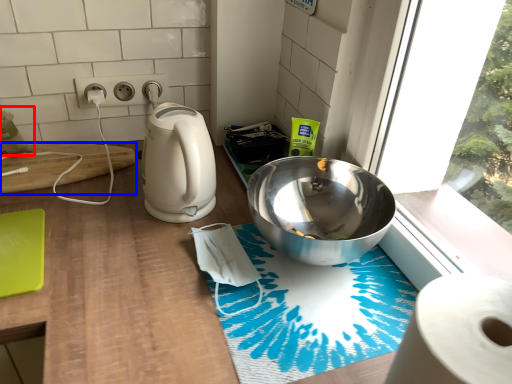
Question: Which of the following is the farthest to the observer, toilet paper (highlighted by a red box) or cutting board (highlighted by a blue box)?

Choices:
 (A) toilet paper
 (B) cutting board

Answer: (B)